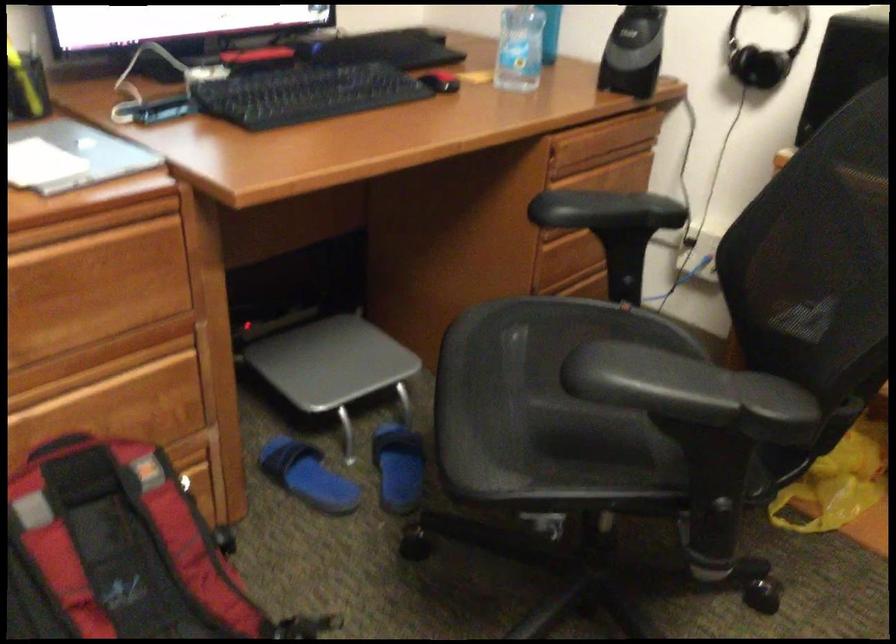
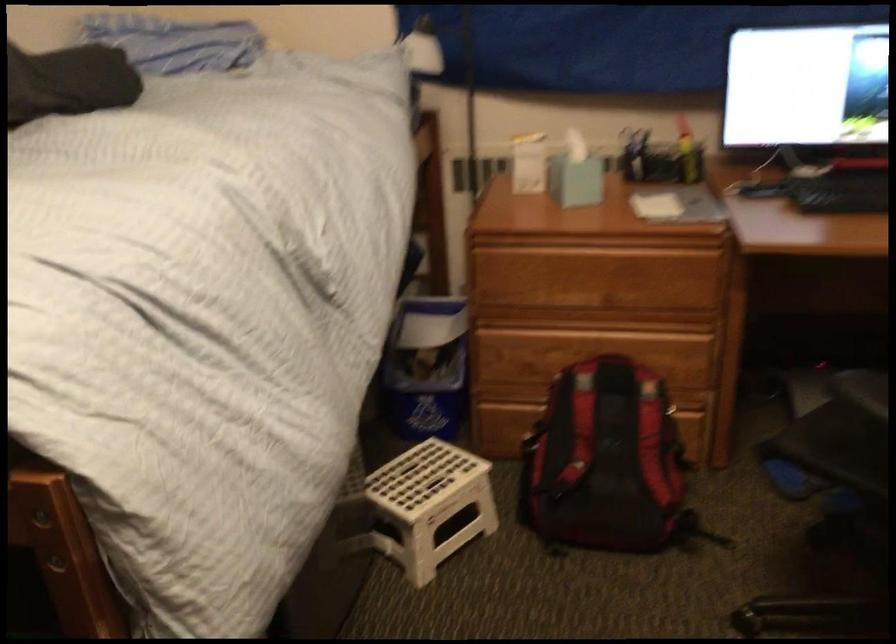
Find the pixel in the second image that matches (x=385, y=478) in the first image.

(833, 495)